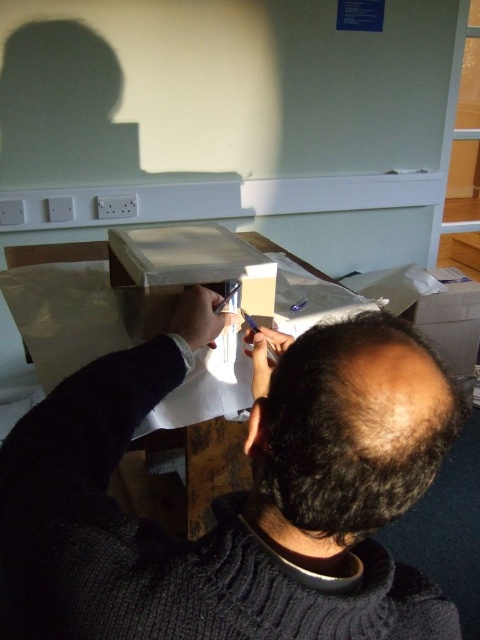
Is dark gray sweater at center shorter than cardboard box at upper right?

Yes, dark gray sweater at center is shorter than cardboard box at upper right.

Who is more distant from viewer, (348, 472) or (465, 321)?

Point (465, 321)

Based on the photo, who is more forward, (55, 388) or (442, 289)?

Positioned in front is point (55, 388).

This screenshot has height=640, width=480. I want to click on dark gray sweater at center, so click(x=237, y=493).

Is matte white box at center bigger than cardboard box at upper right?

No.

Is matte white box at center to the left of cardboard box at upper right from the viewer's perspective?

Indeed, matte white box at center is positioned on the left side of cardboard box at upper right.

Locate an element on the screen. The width and height of the screenshot is (480, 640). matte white box at center is located at coordinates 190,268.

What are the coordinates of `matte white box at center` in the screenshot? It's located at (190, 268).

Consider the image. Is dark gray sweater at center above matte white box at center?

No.

Does dark gray sweater at center appear under matte white box at center?

Yes.

At what (x,y) coordinates should I click in order to perform the action: click on dark gray sweater at center. Please return your answer as a coordinate pair (x, y). Looking at the image, I should click on (237, 493).

The width and height of the screenshot is (480, 640). I want to click on dark gray sweater at center, so click(x=237, y=493).